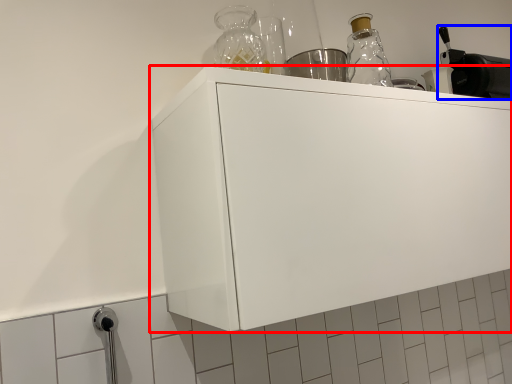
Question: Which of the following is the closest to the observer, cabinetry (highlighted by a red box) or appliance (highlighted by a blue box)?

Choices:
 (A) cabinetry
 (B) appliance

Answer: (A)